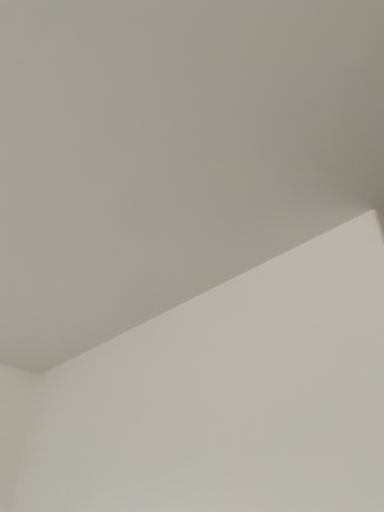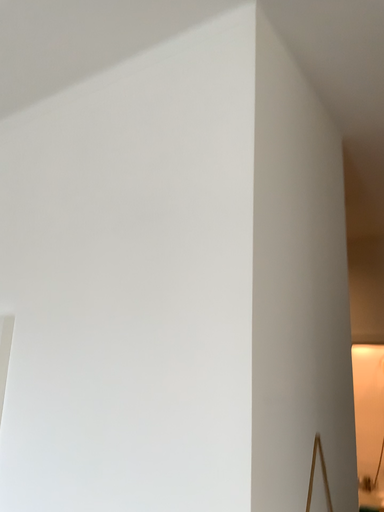
Question: How did the camera likely rotate when shooting the video?

Choices:
 (A) rotated right
 (B) rotated left

Answer: (A)